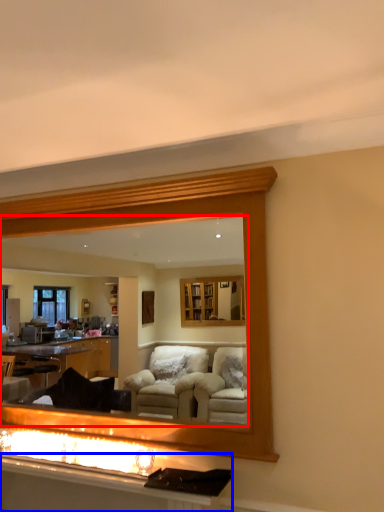
Question: Which point is further to the camera, mirror (highlighted by a red box) or vanity (highlighted by a blue box)?

Choices:
 (A) mirror
 (B) vanity

Answer: (A)